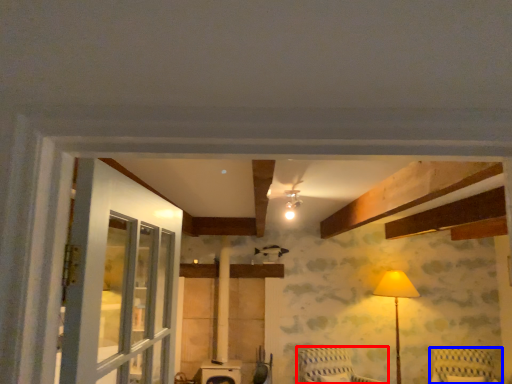
Question: Which object appears farthest to the camera in this image, furniture (highlighted by a red box) or furniture (highlighted by a blue box)?

Choices:
 (A) furniture
 (B) furniture

Answer: (B)